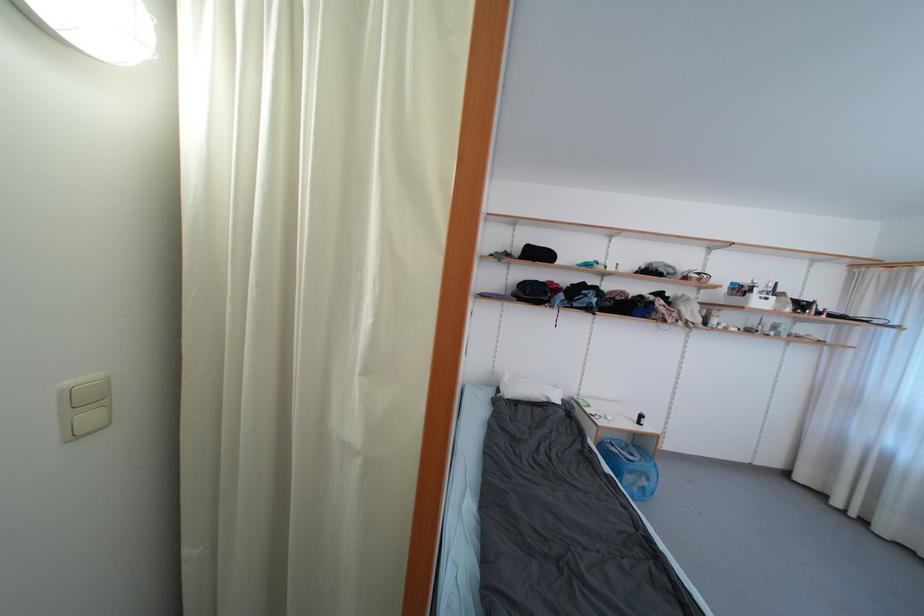
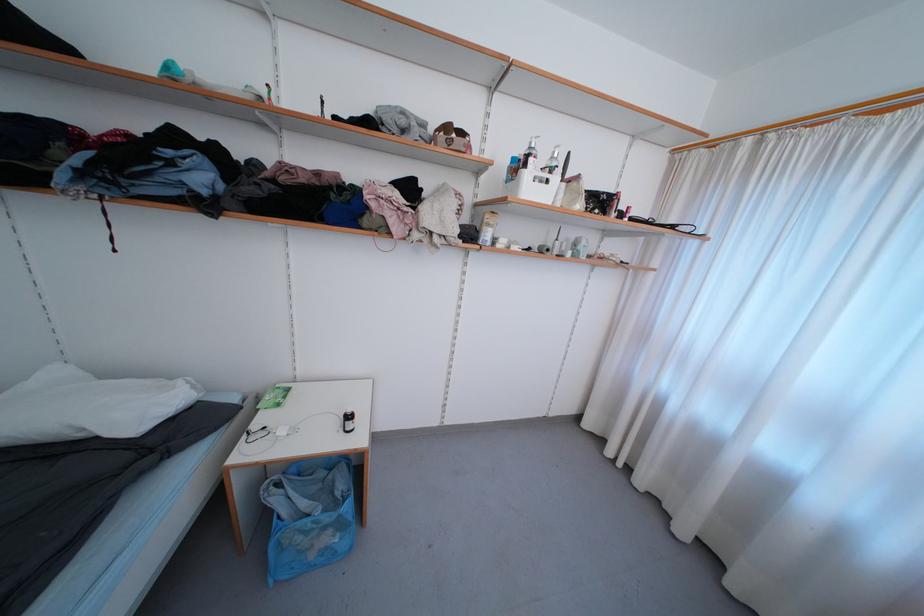
Find the pixel in the second image that matches the point at 616,448 in the first image.

(284, 488)